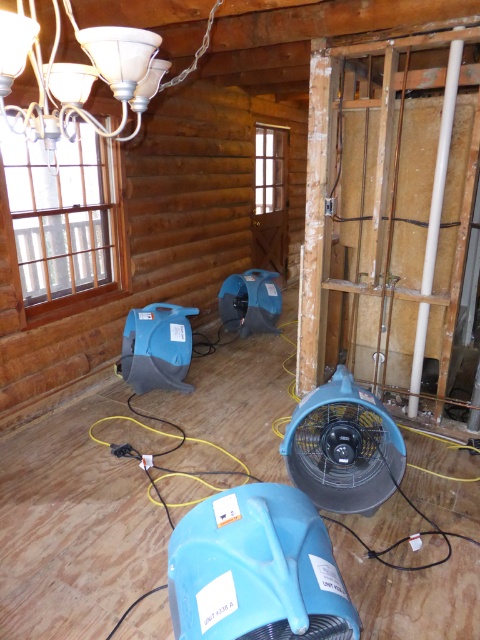
Question: From the image, what is the correct spatial relationship of white frosted glass chandelier at upper left in relation to blue plastic fan at center?

Choices:
 (A) above
 (B) below

Answer: (A)

Question: Which object is farther from the camera taking this photo?

Choices:
 (A) blue plastic fan at center
 (B) white frosted glass chandelier at upper left

Answer: (A)

Question: Can you confirm if white frosted glass chandelier at upper left is smaller than blue plastic fan at center?

Choices:
 (A) no
 (B) yes

Answer: (A)

Question: Which point is closer to the camera?

Choices:
 (A) white frosted glass chandelier at upper left
 (B) blue plastic fan at center

Answer: (A)

Question: Is white frosted glass chandelier at upper left further to camera compared to blue plastic fan at center?

Choices:
 (A) no
 (B) yes

Answer: (A)